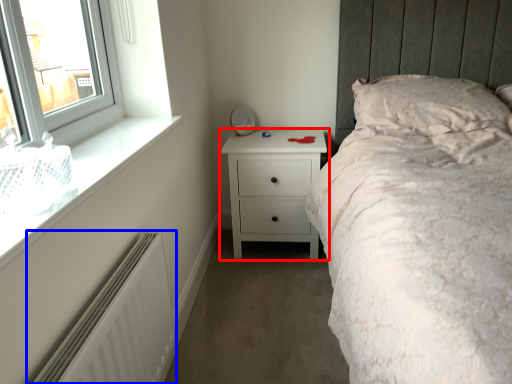
Question: Which object is closer to the camera taking this photo, chest of drawers (highlighted by a red box) or radiator (highlighted by a blue box)?

Choices:
 (A) chest of drawers
 (B) radiator

Answer: (B)